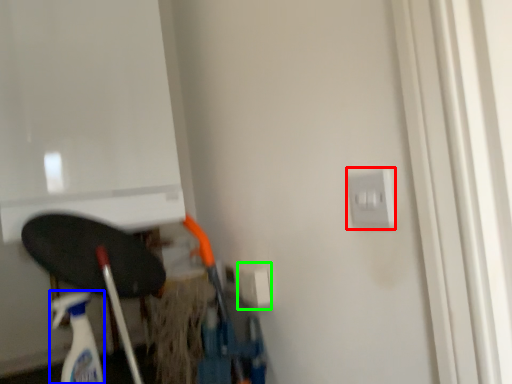
Question: Which object is positioned closest to electric outlet (highlighted by a red box)? Select from cleaning product (highlighted by a blue box) and electric outlet (highlighted by a green box).

Choices:
 (A) cleaning product
 (B) electric outlet

Answer: (B)